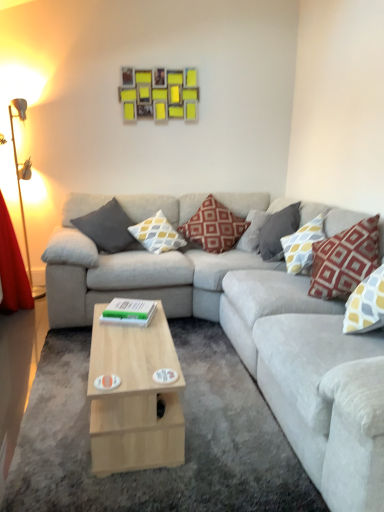
Question: Considering the relative sizes of green matte book at center and gray fabric pillow at upper right, positioned as the third pillow in right-to-left order, in the image provided, is green matte book at center taller than gray fabric pillow at upper right, positioned as the third pillow in right-to-left order,?

Choices:
 (A) no
 (B) yes

Answer: (A)

Question: Are green matte book at center and gray fabric pillow at upper right, the fourth pillow viewed from the left, far apart?

Choices:
 (A) yes
 (B) no

Answer: (A)

Question: Considering the relative sizes of green matte book at center and gray fabric pillow at upper right, positioned as the third pillow in right-to-left order, in the image provided, is green matte book at center smaller than gray fabric pillow at upper right, positioned as the third pillow in right-to-left order,?

Choices:
 (A) no
 (B) yes

Answer: (B)

Question: Can you confirm if green matte book at center is shorter than gray fabric pillow at upper right, the fourth pillow viewed from the left?

Choices:
 (A) yes
 (B) no

Answer: (A)

Question: Considering the relative sizes of green matte book at center and gray fabric pillow at upper right, the fourth pillow viewed from the left, in the image provided, is green matte book at center wider than gray fabric pillow at upper right, the fourth pillow viewed from the left,?

Choices:
 (A) no
 (B) yes

Answer: (A)

Question: From the image's perspective, is light wood/wooden coffee table at center positioned above or below gray fabric pillow at upper right, the fourth pillow viewed from the left?

Choices:
 (A) below
 (B) above

Answer: (A)

Question: Considering the positions of light wood/wooden coffee table at center and gray fabric pillow at upper right, the fourth pillow viewed from the left, in the image, is light wood/wooden coffee table at center wider or thinner than gray fabric pillow at upper right, the fourth pillow viewed from the left,?

Choices:
 (A) thin
 (B) wide

Answer: (B)

Question: From a real-world perspective, is light wood/wooden coffee table at center above or below gray fabric pillow at upper right, positioned as the third pillow in right-to-left order?

Choices:
 (A) above
 (B) below

Answer: (B)

Question: From their relative heights in the image, would you say light wood/wooden coffee table at center is taller or shorter than gray fabric pillow at upper right, the fourth pillow viewed from the left?

Choices:
 (A) short
 (B) tall

Answer: (A)

Question: Visually, is gray fabric pillow at upper right, positioned as the third pillow in right-to-left order, positioned to the left or to the right of red textured pillow at right, the 6th pillow positioned from the left?

Choices:
 (A) right
 (B) left

Answer: (B)

Question: Is gray fabric pillow at upper right, the fourth pillow viewed from the left, inside or outside of red textured pillow at right, which ranks as the first pillow in right-to-left order?

Choices:
 (A) inside
 (B) outside

Answer: (B)

Question: Is gray fabric pillow at upper right, positioned as the third pillow in right-to-left order, bigger or smaller than red textured pillow at right, the 6th pillow positioned from the left?

Choices:
 (A) small
 (B) big

Answer: (A)

Question: From a real-world perspective, is gray fabric pillow at upper right, the fourth pillow viewed from the left, positioned above or below red textured pillow at right, which ranks as the first pillow in right-to-left order?

Choices:
 (A) above
 (B) below

Answer: (B)

Question: Considering their positions, is light gray fabric couch at center located in front of or behind yellow and gray patterned pillow at right, the 2th pillow in the right-to-left sequence?

Choices:
 (A) behind
 (B) front

Answer: (B)

Question: Based on their positions, is light gray fabric couch at center located to the left or right of yellow and gray patterned pillow at right, acting as the 5th pillow starting from the left?

Choices:
 (A) right
 (B) left

Answer: (B)